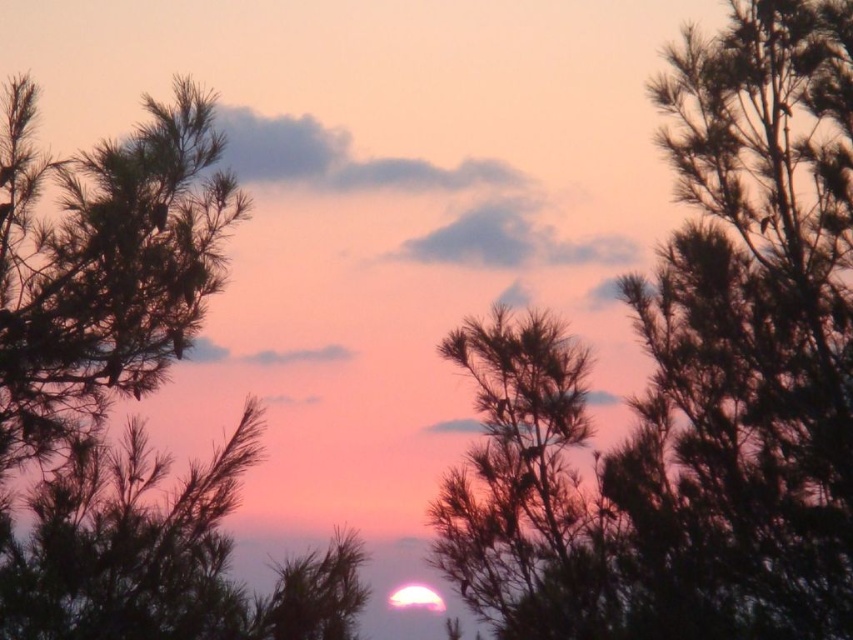
Which is in front, point (750, 61) or point (560, 420)?

Point (750, 61)

Can you confirm if silky dark green tree at center is thinner than silvery metallic tree at center?

In fact, silky dark green tree at center might be wider than silvery metallic tree at center.

Locate an element on the screen. silky dark green tree at center is located at coordinates (692, 385).

Between silky dark green tree at center and green matte tree at center, which one is positioned higher?

silky dark green tree at center

Does point (822, 368) come farther from viewer compared to point (91, 637)?

That is True.

This screenshot has height=640, width=853. In order to click on silky dark green tree at center in this screenshot , I will do `click(692, 385)`.

Does point (38, 488) come behind point (540, 547)?

No, it is in front of (540, 547).

Measure the distance between point (45, 417) and camera.

73.65 feet

Where is `green matte tree at center`? The height and width of the screenshot is (640, 853). green matte tree at center is located at coordinates (128, 394).